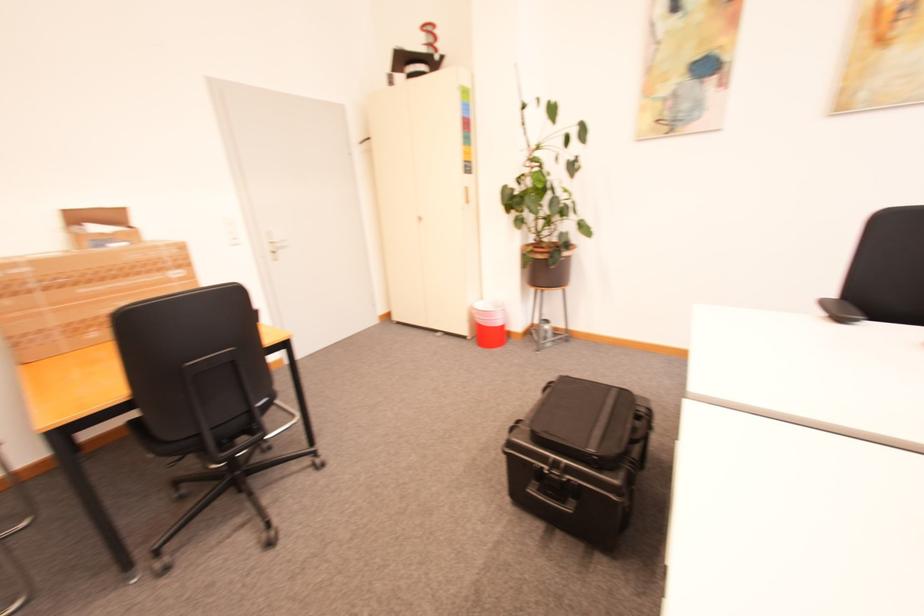
The image size is (924, 616). What do you see at coordinates (274, 246) in the screenshot? I see `a silver door handle` at bounding box center [274, 246].